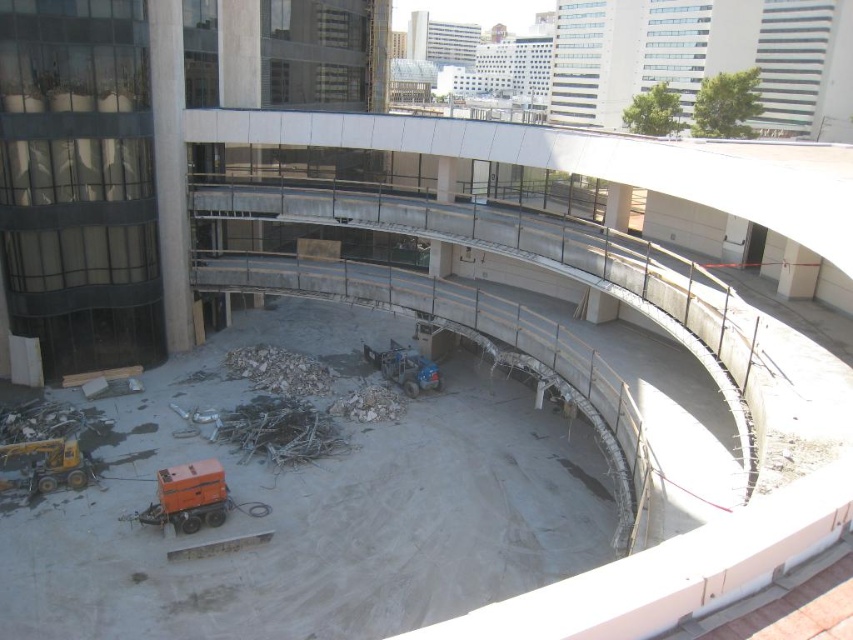
Question: Is yellow metallic excavator at lower left to the right of blue metallic forklift at center from the viewer's perspective?

Choices:
 (A) no
 (B) yes

Answer: (A)

Question: Observing the image, what is the correct spatial positioning of white rubble at center in reference to yellow metallic excavator at lower left?

Choices:
 (A) right
 (B) left

Answer: (A)

Question: Is white rubble at center closer to the viewer compared to blue metallic forklift at center?

Choices:
 (A) no
 (B) yes

Answer: (A)

Question: Which point is farther to the camera?

Choices:
 (A) (84, 470)
 (B) (363, 406)
 (C) (257, 362)
 (D) (189, 486)

Answer: (C)

Question: Which object is farther from the camera taking this photo?

Choices:
 (A) blue metallic forklift at center
 (B) white rubble at center

Answer: (B)

Question: Among these points, which one is nearest to the camera?

Choices:
 (A) (175, 496)
 (B) (380, 410)
 (C) (407, 356)
 (D) (32, 483)

Answer: (A)